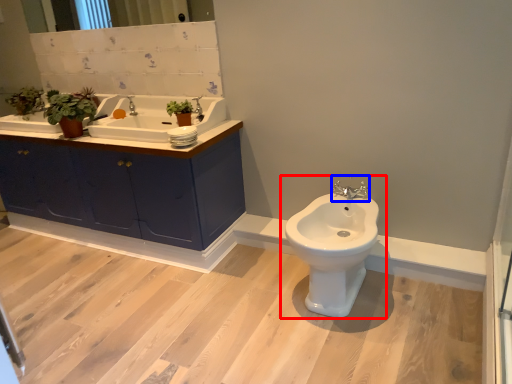
Question: Which object appears farthest to the camera in this image, toilet (highlighted by a red box) or tap (highlighted by a blue box)?

Choices:
 (A) toilet
 (B) tap

Answer: (B)